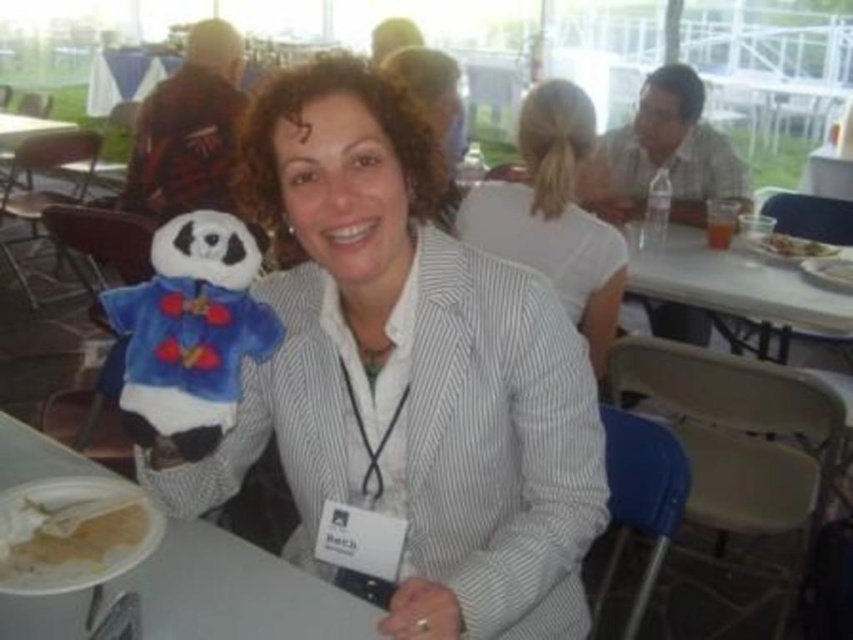
You are a photographer trying to capture the white plastic plate at lower left in the center of your camera frame. Given that the camera has a 100mm focal length and you are standing 3 meters away from the table, can you estimate whether the plate will be centered in your frame? Please consider the plate is at coordinates point 0.927, 0.277 and the center of the frame is at point 0.5, 0.5.

The white plastic plate at lower left is located at point (235,593), which is far from the center of the frame at (426,320). Therefore, the plate will not be centered in the frame.

You are a photographer at the event and need to capture a closeup of the white paper plate at lower left without the smooth plastic fork at upper right appearing in the shot. Can you adjust your camera angle to achieve this?

Yes, since the white paper plate at lower left is in front of the smooth plastic fork at upper right, you can angle the camera downward to focus on the plate while blocking the fork from view.

You are a photographer at the event and need to capture a photo of the woman without including the white paper plate at lower left. Since the white striped blazer at center is in the way, can you adjust your position to the left or right to frame the shot properly?

The white striped blazer at center is positioned on the right side of the white paper plate at lower left. To avoid including the white paper plate at lower left in the photo, you should move to the right side of the setup to position the white striped blazer at center between the camera and the plate.